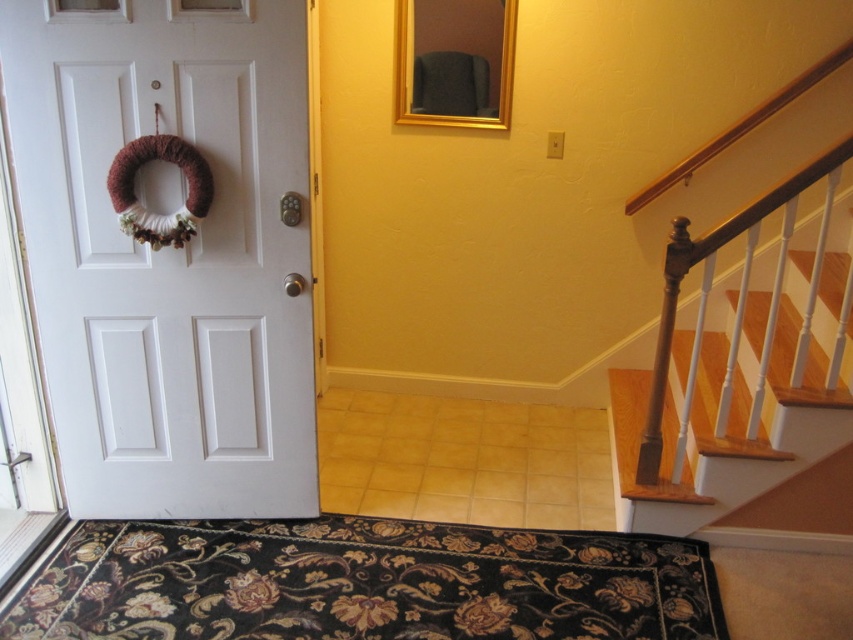
Can you confirm if white matte door at left is taller than wooden stairs at right?

Indeed, white matte door at left has a greater height compared to wooden stairs at right.

Does white matte door at left come in front of wooden stairs at right?

Yes, white matte door at left is closer to the viewer.

Where is `white matte door at left`? white matte door at left is located at coordinates (167, 253).

Does white matte door at left come behind black floral rug at lower center?

No, it is in front of black floral rug at lower center.

In the scene shown: Can you confirm if white matte door at left is thinner than black floral rug at lower center?

Correct, white matte door at left's width is less than black floral rug at lower center's.

Is point (3, 17) positioned behind point (157, 582)?

No, (3, 17) is closer to viewer.

The height and width of the screenshot is (640, 853). Find the location of `white matte door at left`. white matte door at left is located at coordinates (167, 253).

Is black floral rug at lower center further to camera compared to wooden stairs at right?

No, black floral rug at lower center is in front of wooden stairs at right.

Between point (433, 593) and point (706, 470), which one is positioned in front?

Point (433, 593) is in front.

This screenshot has height=640, width=853. Identify the location of black floral rug at lower center. (364, 582).